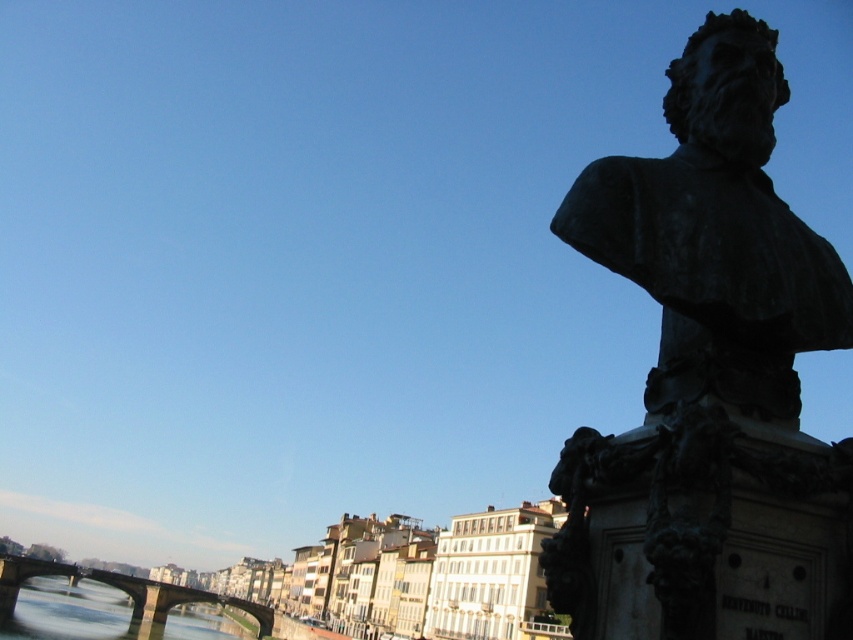
Question: Can you confirm if bronze bust at right is positioned to the left of concrete bridge at lower left?

Choices:
 (A) no
 (B) yes

Answer: (A)

Question: Where is bronze bust at right located in relation to concrete bridge at lower left in the image?

Choices:
 (A) left
 (B) right

Answer: (B)

Question: Is bronze bust at right to the left of concrete bridge at lower left from the viewer's perspective?

Choices:
 (A) yes
 (B) no

Answer: (B)

Question: Which point is farther to the camera?

Choices:
 (A) (32, 557)
 (B) (657, 428)

Answer: (A)

Question: Which object is farther from the camera taking this photo?

Choices:
 (A) concrete bridge at lower left
 (B) bronze bust at right

Answer: (A)

Question: Which point is farther to the camera?

Choices:
 (A) bronze bust at right
 (B) concrete bridge at lower left

Answer: (B)